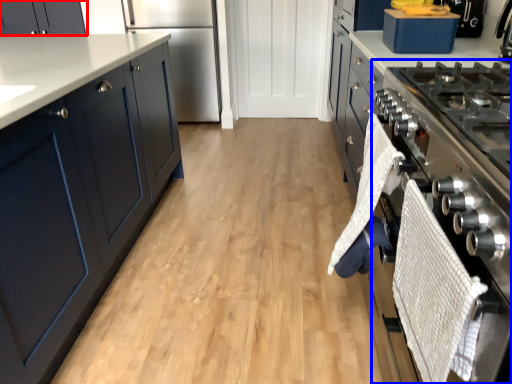
Question: Which point is closer to the camera, cabinetry (highlighted by a red box) or oven (highlighted by a blue box)?

Choices:
 (A) cabinetry
 (B) oven

Answer: (B)